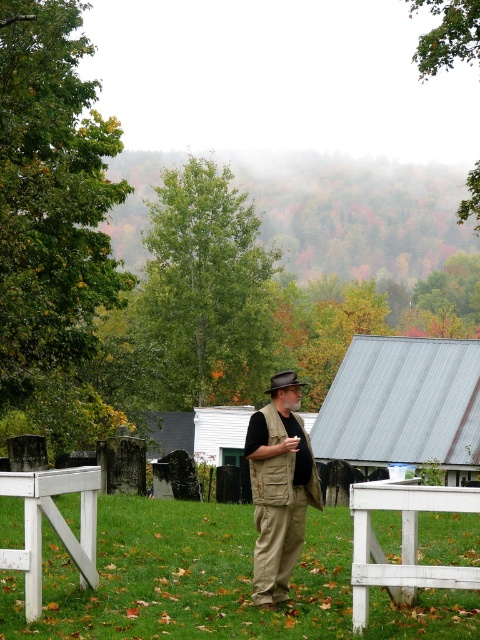
You are planning to set up a picnic and notice two picnic tables in the scene. Which one is positioned lower in the image, the white wooden picnic table at lower right or the white painted wood picnic table at lower left?

The white wooden picnic table at lower right is positioned lower in the image compared to the white painted wood picnic table at lower left, as it is located below it.

You are standing at the point marked as point [404,404] and want to reach the metallic gray hut at center right. What direction should you move in?

The metallic gray hut at center right is located at point [404,404], so you are already at the location of the metallic gray hut at center right.